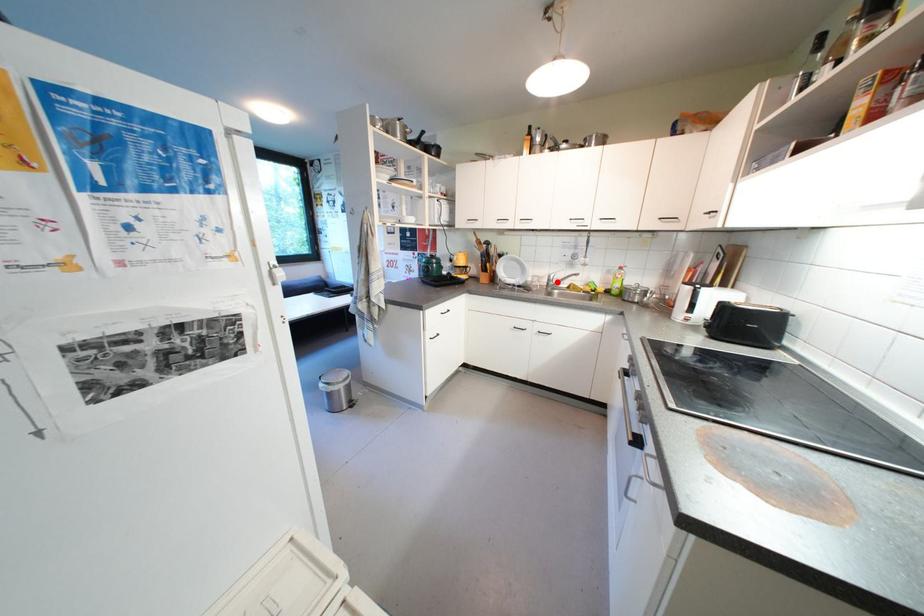
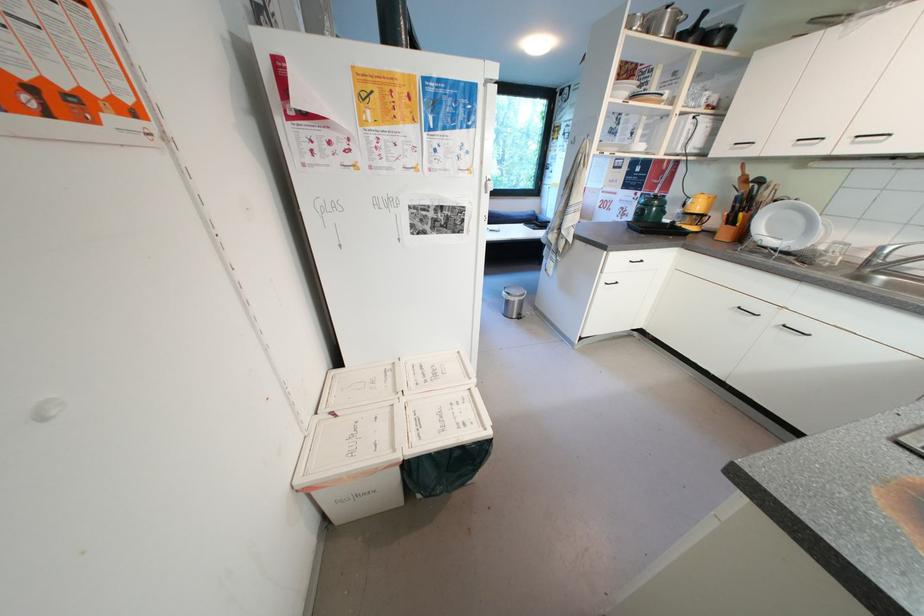
Question: A red point is marked in image1. In image2, is the corresponding 3D point closer to the camera or farther? Reply with the corresponding letter.

Choices:
 (A) The corresponding 3D point is closer.
 (B) The corresponding 3D point is farther.

Answer: (B)